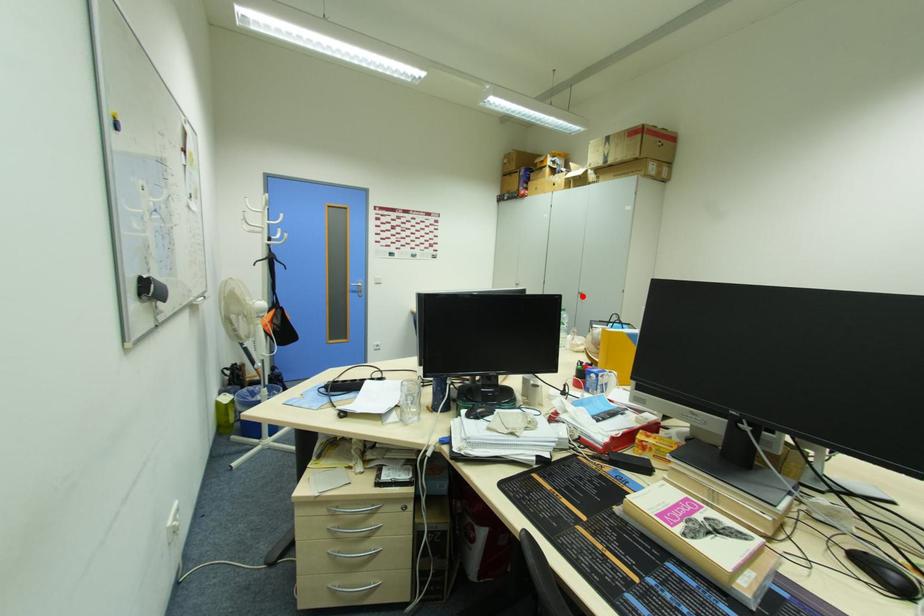
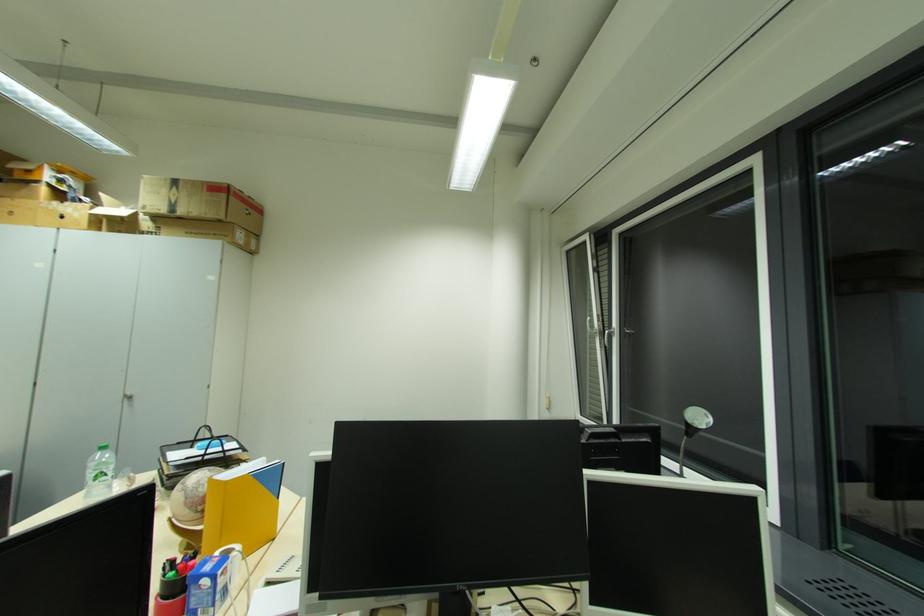
Find the pixel in the second image that matches the highlighted location in the first image.

(128, 400)